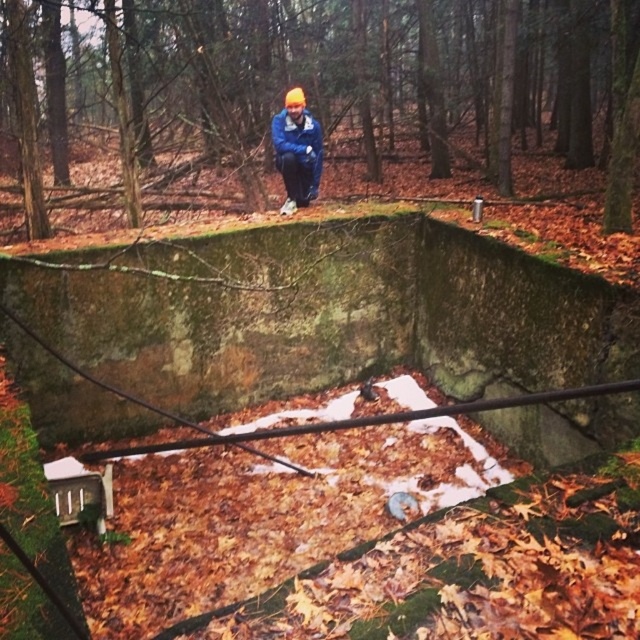
Who is more distant from viewer, (554, 141) or (289, 152)?

The point (554, 141) is behind.

The image size is (640, 640). I want to click on green mossy stone at center, so 352,92.

Is point (454, 145) farther from viewer compared to point (316, 124)?

Yes, it is behind point (316, 124).

Identify the location of green mossy stone at center. (352, 92).